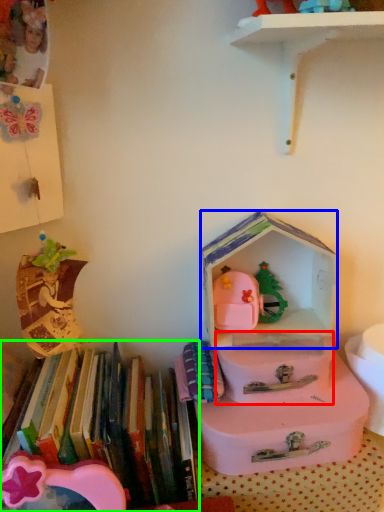
Question: Which object is positioned farthest from box (highlighted by a red box)? Select from storage box (highlighted by a blue box) and book (highlighted by a green box).

Choices:
 (A) storage box
 (B) book

Answer: (B)